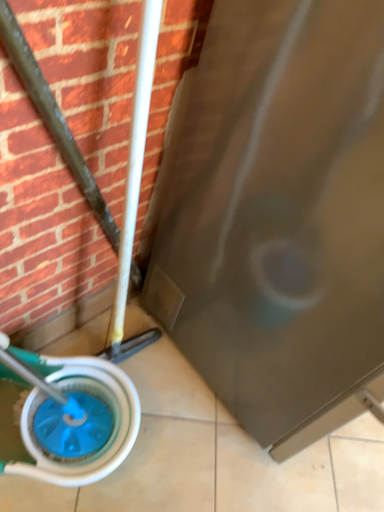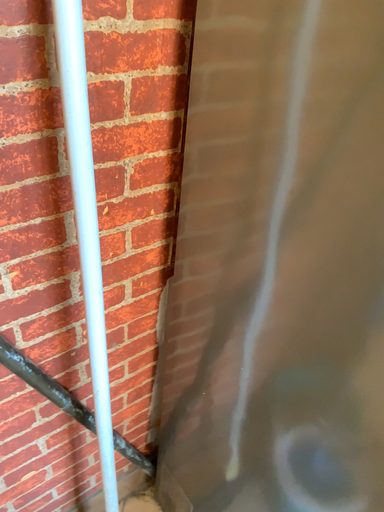
Question: Which way did the camera rotate in the video?

Choices:
 (A) rotated left
 (B) rotated right

Answer: (A)